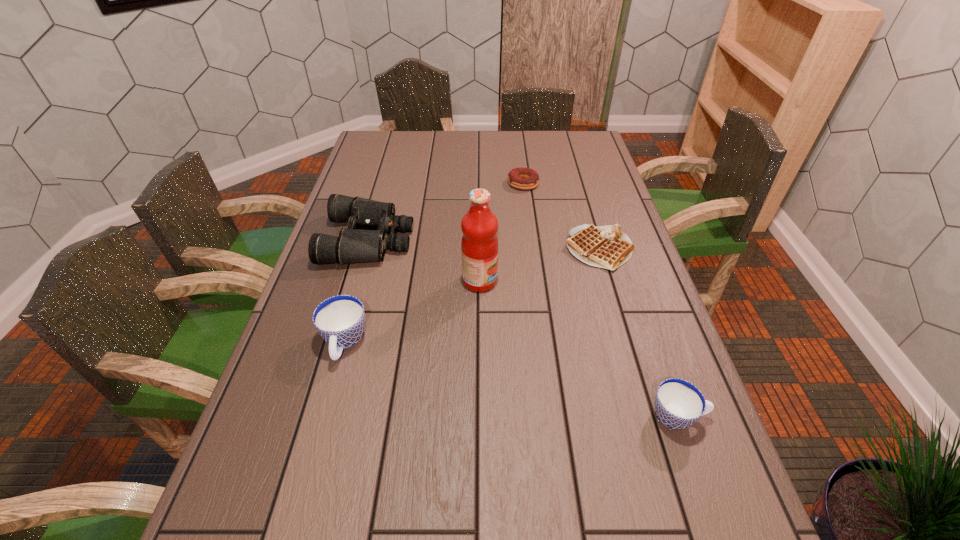
The width and height of the screenshot is (960, 540). I want to click on free space for an extra cup to achieve even spacing, so click(x=500, y=377).